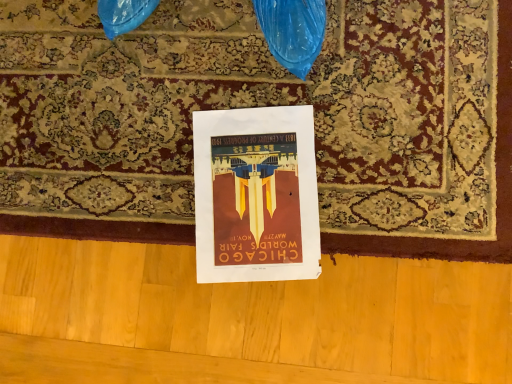
The height and width of the screenshot is (384, 512). Identify the location of matte paper poster at center. (256, 195).

The height and width of the screenshot is (384, 512). Describe the element at coordinates (256, 195) in the screenshot. I see `matte paper poster at center` at that location.

Where is `matte paper poster at center`? This screenshot has height=384, width=512. matte paper poster at center is located at coordinates (256, 195).